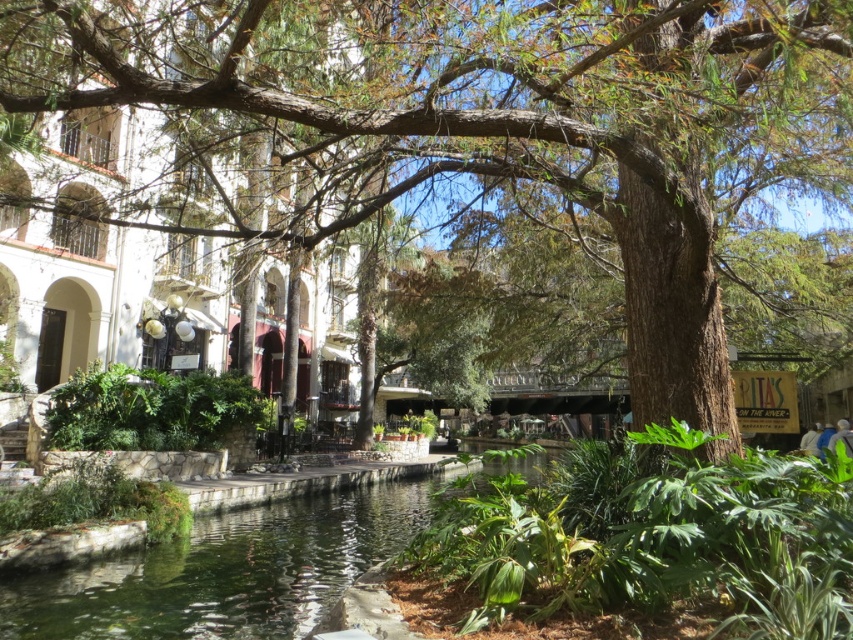
You are standing at the center of the stone walkway and want to find the brown textured tree at center. According to the coordinates provided, in which direction should you look to locate it?

The brown textured tree at center is located at coordinates point (491, 124), which means it is positioned to the left and slightly above the center point of the image. Therefore, you should look to your left and slightly upwards to locate it.

You are a landscape architect designing a walking path between the brown textured tree at center and the green liquid water at center. The path must be exactly 30 feet long. Can you safely create the path without exceeding the available space?

Answer: The distance between the brown textured tree at center and the green liquid water at center is 30.18 feet, so yes, the path can be safely created as the available space is slightly longer than the required 30 feet.

You are planning to cross the river using a small boat. The boat can only carry you and one object from the scene. Which object should you choose between the brown textured tree at center and the green liquid water at center, and why?

You should choose the green liquid water at center because the brown textured tree at center is positioned on the right side of it, so the water is likely the path to cross the river.